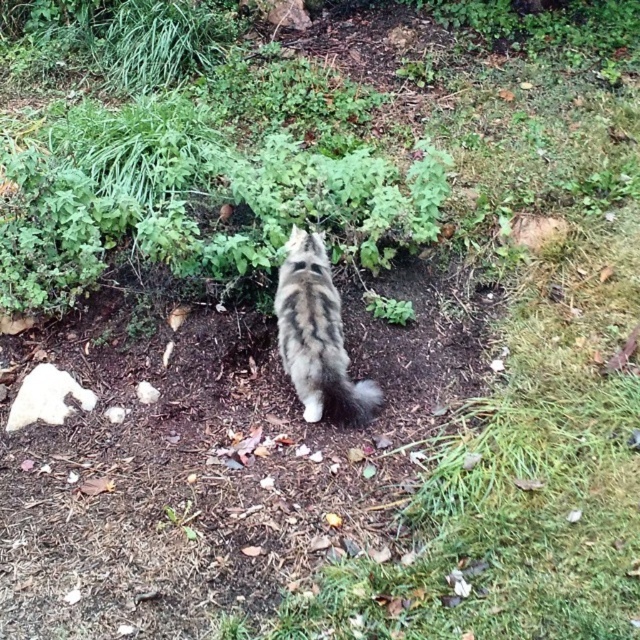
Between tabby fur cat at center and fuzzy gray tail at center, which one appears on the right side from the viewer's perspective?

Positioned to the right is fuzzy gray tail at center.

Who is higher up, tabby fur cat at center or fuzzy gray tail at center?

tabby fur cat at center is above.

Between point (292, 275) and point (349, 422), which one is positioned in front?

Positioned in front is point (349, 422).

I want to click on tabby fur cat at center, so click(x=316, y=333).